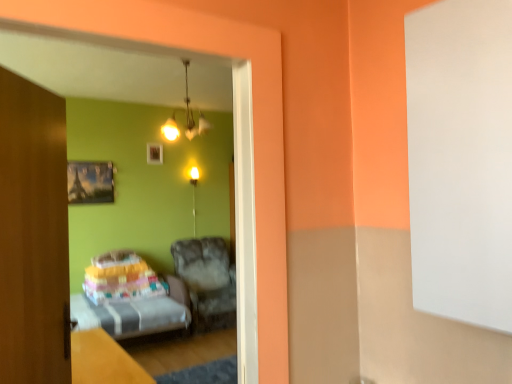
Question: From the image's perspective, is wooden picture frame at upper center, the first picture frame when ordered from right to left, located beneath matte gold light fixture at center?

Choices:
 (A) no
 (B) yes

Answer: (A)

Question: Is wooden picture frame at upper center, the first picture frame when ordered from right to left, to the left of matte gold light fixture at center from the viewer's perspective?

Choices:
 (A) yes
 (B) no

Answer: (A)

Question: Is wooden picture frame at upper center, which is the 1th picture frame from back to front, touching matte gold light fixture at center?

Choices:
 (A) no
 (B) yes

Answer: (A)

Question: Considering the relative positions of wooden picture frame at upper center, which is the second picture frame from bottom to top, and matte gold light fixture at center in the image provided, is wooden picture frame at upper center, which is the second picture frame from bottom to top, in front of matte gold light fixture at center?

Choices:
 (A) no
 (B) yes

Answer: (B)

Question: Does wooden picture frame at upper center, the second picture frame in the left-to-right sequence, have a greater height compared to matte gold light fixture at center?

Choices:
 (A) yes
 (B) no

Answer: (B)

Question: Would you say wooden picture frame at upper center, which is the second picture frame from bottom to top, is outside matte gold light fixture at center?

Choices:
 (A) yes
 (B) no

Answer: (A)

Question: Is wooden table at lower left to the right of wooden door at left from the viewer's perspective?

Choices:
 (A) yes
 (B) no

Answer: (B)

Question: From a real-world perspective, is wooden table at lower left physically above wooden door at left?

Choices:
 (A) no
 (B) yes

Answer: (A)

Question: From the image's perspective, is wooden table at lower left beneath wooden door at left?

Choices:
 (A) no
 (B) yes

Answer: (B)

Question: Is wooden table at lower left wider than wooden door at left?

Choices:
 (A) no
 (B) yes

Answer: (B)

Question: Does wooden table at lower left touch wooden door at left?

Choices:
 (A) no
 (B) yes

Answer: (A)

Question: Is wooden table at lower left completely or partially outside of wooden door at left?

Choices:
 (A) yes
 (B) no

Answer: (A)

Question: Is there a large distance between metallic silver picture frame at upper left, the second picture frame viewed from the back, and wooden table at lower left?

Choices:
 (A) no
 (B) yes

Answer: (B)